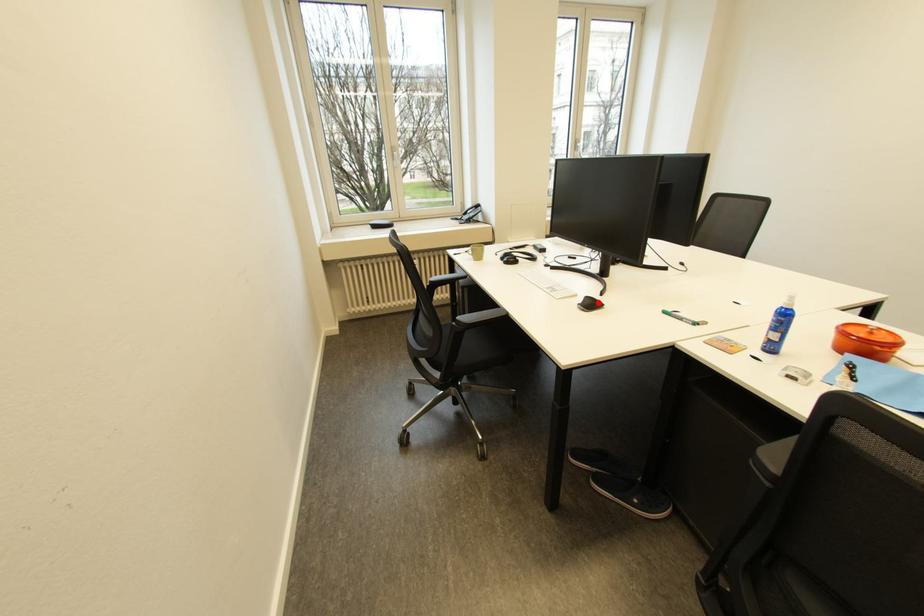
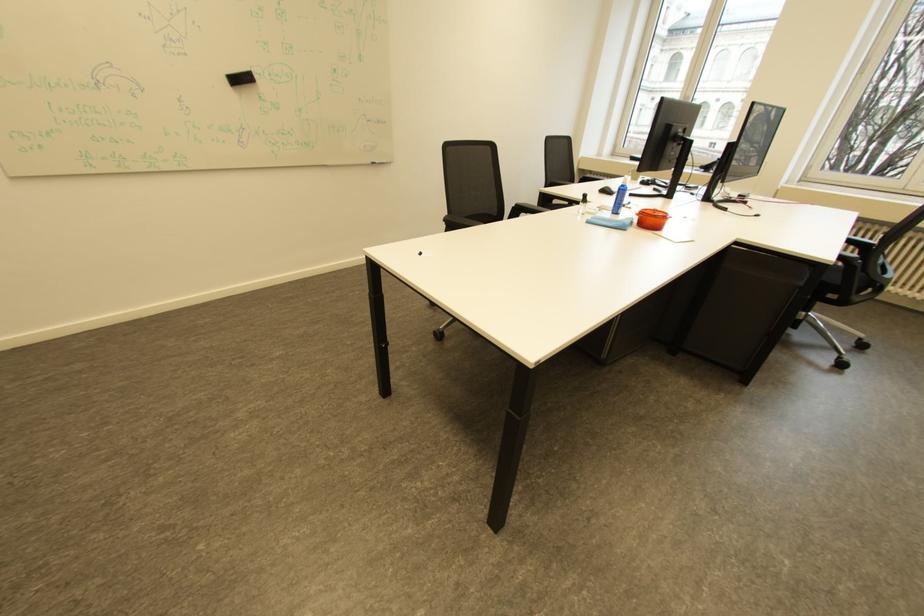
Where in the second image is the point corresponding to the highlighted location from the first image?

(617, 191)